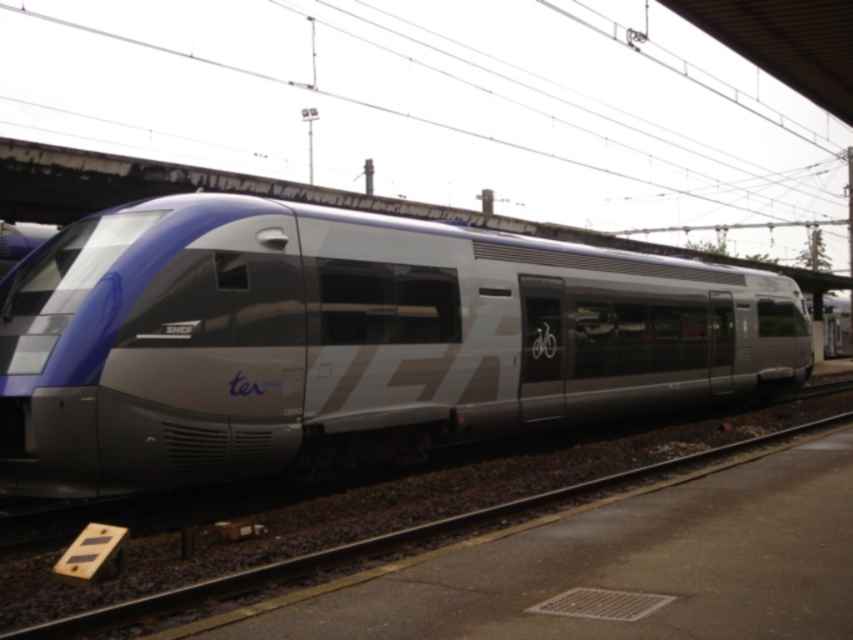
You are a photographer standing on the platform. You want to take a photo of the matte silver train at center and the metallic train track at center. Which object should you focus on first if you want the larger object to be in focus?

The matte silver train at center is larger than the metallic train track at center, so you should focus on the matte silver train at center first to ensure it is in focus.